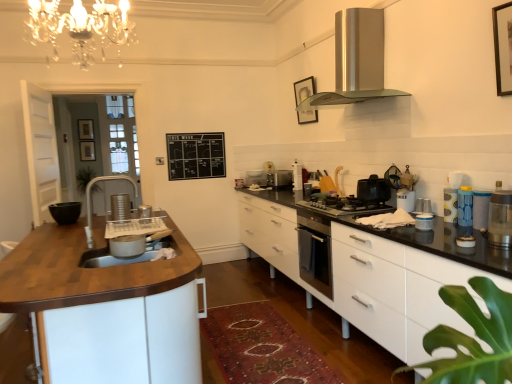
What is the approximate width of wooden picture frame at upper center, positioned as the 2th picture frame in right-to-left order?

The width of wooden picture frame at upper center, positioned as the 2th picture frame in right-to-left order, is 2.83 inches.

How much space does translucent plastic container at right, marked as the 1th kitchen appliance in a front-to-back arrangement, occupy vertically?

It is 9.76 inches.

Measure the distance between satin silver toaster at center, arranged as the second appliance when viewed from the back, and camera.

The distance of satin silver toaster at center, arranged as the second appliance when viewed from the back, from camera is 4.41 meters.

The height and width of the screenshot is (384, 512). What are the coordinates of `black glass gas stove at center` in the screenshot? It's located at (343, 205).

Describe the element at coordinates (424, 221) in the screenshot. I see `blue plastic container at right, which appears as the 7th appliance when viewed from the right` at that location.

Image resolution: width=512 pixels, height=384 pixels. Describe the element at coordinates (406, 199) in the screenshot. I see `white glossy container at right, arranged as the 4th appliance when viewed from the back` at that location.

Locate an element on the screen. The height and width of the screenshot is (384, 512). wooden picture frame at upper center, which is the 3th picture frame from left to right is located at coordinates (304, 89).

From the image's perspective, would you say blue translucent water bottle at right, marked as the 9th appliance in a back-to-front arrangement, is shown under wooden at left?

No, from the image's perspective, blue translucent water bottle at right, marked as the 9th appliance in a back-to-front arrangement, is not beneath wooden at left.

Considering the relative sizes of blue translucent water bottle at right, marked as the 9th appliance in a back-to-front arrangement, and wooden at left in the image provided, is blue translucent water bottle at right, marked as the 9th appliance in a back-to-front arrangement, thinner than wooden at left?

Yes, blue translucent water bottle at right, marked as the 9th appliance in a back-to-front arrangement, is thinner than wooden at left.

Considering the sizes of objects blue translucent water bottle at right, the second appliance positioned from the right, and wooden at left in the image provided, who is taller, blue translucent water bottle at right, the second appliance positioned from the right, or wooden at left?

wooden at left.

From a real-world perspective, is blue translucent water bottle at right, which appears as the third appliance when viewed from the front, on wooden at left?

Yes, from a real-world perspective, blue translucent water bottle at right, which appears as the third appliance when viewed from the front, is above wooden at left.

Who is bigger, blue translucent water bottle at right, the 10th appliance positioned from the left, or black glass stove at center, which ranks as the fourth appliance in left-to-right order?

With larger size is black glass stove at center, which ranks as the fourth appliance in left-to-right order.

Can you confirm if blue translucent water bottle at right, marked as the 9th appliance in a back-to-front arrangement, is thinner than black glass stove at center, arranged as the 3th appliance when viewed from the back?

No.

Considering the sizes of objects blue translucent water bottle at right, marked as the 9th appliance in a back-to-front arrangement, and black glass stove at center, which ranks as the ninth appliance in front-to-back order, in the image provided, who is taller, blue translucent water bottle at right, marked as the 9th appliance in a back-to-front arrangement, or black glass stove at center, which ranks as the ninth appliance in front-to-back order,?

With more height is blue translucent water bottle at right, marked as the 9th appliance in a back-to-front arrangement.

Is the surface of blue translucent water bottle at right, which appears as the third appliance when viewed from the front, in direct contact with black glass stove at center, placed as the 8th appliance when sorted from right to left?

blue translucent water bottle at right, which appears as the third appliance when viewed from the front, and black glass stove at center, placed as the 8th appliance when sorted from right to left, are clearly separated.

Can you see black glass stove at center, arranged as the 3th appliance when viewed from the back, touching white glossy container at right, which appears as the seventh appliance when viewed from the left?

No, black glass stove at center, arranged as the 3th appliance when viewed from the back, is not touching white glossy container at right, which appears as the seventh appliance when viewed from the left.

Considering the positions of objects black glass stove at center, which ranks as the ninth appliance in front-to-back order, and white glossy container at right, the 8th appliance when ordered from front to back, in the image provided, who is more to the right, black glass stove at center, which ranks as the ninth appliance in front-to-back order, or white glossy container at right, the 8th appliance when ordered from front to back,?

white glossy container at right, the 8th appliance when ordered from front to back, is more to the right.

Based on the photo, is black glass stove at center, placed as the 8th appliance when sorted from right to left, bigger or smaller than white glossy container at right, which is the fifth appliance from right to left?

black glass stove at center, placed as the 8th appliance when sorted from right to left, is bigger than white glossy container at right, which is the fifth appliance from right to left.

Looking at this image, from a real-world perspective, which is physically above, black glass stove at center, which ranks as the fourth appliance in left-to-right order, or white glossy container at right, arranged as the 4th appliance when viewed from the back?

black glass stove at center, which ranks as the fourth appliance in left-to-right order.

Does point (292, 168) appear closer or farther from the camera than point (95, 159)?

Clearly, point (292, 168) is closer to the camera than point (95, 159).

From a real-world perspective, between satin silver toaster at center, the third appliance viewed from the left, and wooden picture frame at upper left, the second picture frame from the left, who is vertically higher?

wooden picture frame at upper left, the second picture frame from the left, is physically above.

From the image's perspective, between satin silver toaster at center, which appears as the tenth appliance when viewed from the front, and wooden picture frame at upper left, which is the 1th picture frame from back to front, which one is located above?

From the image's view, wooden picture frame at upper left, which is the 1th picture frame from back to front, is above.

Considering the sizes of objects satin silver toaster at center, arranged as the second appliance when viewed from the back, and wooden picture frame at upper left, which is the 3th picture frame from right to left, in the image provided, who is shorter, satin silver toaster at center, arranged as the second appliance when viewed from the back, or wooden picture frame at upper left, which is the 3th picture frame from right to left,?

With less height is satin silver toaster at center, arranged as the second appliance when viewed from the back.

Find the location of a particular element. The width and height of the screenshot is (512, 384). the 2nd picture frame to the left of the white glossy container at right, arranged as the 4th appliance when viewed from the back, counting from the anchor's position is located at coordinates (87, 150).

Is wooden picture frame at upper left, which is the 1th picture frame from back to front, inside or outside of white glossy container at right, the 8th appliance when ordered from front to back?

The correct answer is: outside.

Does wooden picture frame at upper left, arranged as the 4th picture frame when viewed from the front, have a lesser height compared to white glossy container at right, the 8th appliance when ordered from front to back?

No.

In the scene shown: From the image's perspective, does wooden picture frame at upper left, arranged as the 4th picture frame when viewed from the front, appear lower than white glossy container at right, the 8th appliance when ordered from front to back?

No, from the image's perspective, wooden picture frame at upper left, arranged as the 4th picture frame when viewed from the front, is not beneath white glossy container at right, the 8th appliance when ordered from front to back.

From a real-world perspective, which is physically above, wooden picture frame at upper left, the third picture frame viewed from the front, or black chalkboard at upper center?

In real-world perspective, wooden picture frame at upper left, the third picture frame viewed from the front, is above.

Can you confirm if wooden picture frame at upper left, which is the 1th picture frame from left to right, is taller than black chalkboard at upper center?

No.

From a real-world perspective, which object stands above the other?

black wooden picture frame at upper right, which appears as the 4th picture frame when viewed from the back.

Between black wooden picture frame at upper right, which is the fourth picture frame in left-to-right order, and black chalkboard at upper center, which one appears on the right side from the viewer's perspective?

black wooden picture frame at upper right, which is the fourth picture frame in left-to-right order, is more to the right.

Consider the image. Who is taller, black wooden picture frame at upper right, which appears as the 4th picture frame when viewed from the back, or black chalkboard at upper center?

With more height is black chalkboard at upper center.

Is black wooden picture frame at upper right, which is the fourth picture frame in left-to-right order, closer to camera compared to black chalkboard at upper center?

Yes, black wooden picture frame at upper right, which is the fourth picture frame in left-to-right order, is closer to the camera.

Identify the location of appliance that is the 3rd one when counting backward from the wooden at left. The image size is (512, 384). (465, 206).

Find the location of a particular element. appliance that is the 6th one when counting leftward from the blue translucent water bottle at right, the 10th appliance positioned from the left is located at coordinates (327, 184).

Which object lies further to the anchor point black glass gas stove at center, blue rubber cup at right, the fourth appliance positioned from the front, or white glossy container at right, which is the fifth appliance from right to left?

blue rubber cup at right, the fourth appliance positioned from the front, is positioned further to the anchor black glass gas stove at center.

Based on their spatial positions, is brushed metal faucet at left or wooden picture frame at upper left, the third picture frame viewed from the front, further from white matte cabinet at center?

wooden picture frame at upper left, the third picture frame viewed from the front.

Considering their positions, is blue rubber cup at right, which is the ninth appliance in left-to-right order, positioned further to satin silver toaster at center, placed as the 9th appliance when sorted from right to left, than translucent plastic container at right, acting as the 11th appliance starting from the back?

translucent plastic container at right, acting as the 11th appliance starting from the back.

Consider the image. Based on their spatial positions, is wooden picture frame at upper center, which appears as the third picture frame when viewed from the back, or blue plastic container at right, the second appliance positioned from the front, further from wooden picture frame at upper left, the fourth picture frame from the right?

Based on the image, blue plastic container at right, the second appliance positioned from the front, appears to be further to wooden picture frame at upper left, the fourth picture frame from the right.

Estimate the real-world distances between objects in this image. Which object is closer to blue plastic container at right, the second appliance positioned from the front, black wooden picture frame at upper right, placed as the first picture frame when sorted from right to left, or black chalkboard at upper center?

The object closer to blue plastic container at right, the second appliance positioned from the front, is black wooden picture frame at upper right, placed as the first picture frame when sorted from right to left.

Estimate the real-world distances between objects in this image. Which object is further from wooden picture frame at upper left, arranged as the 2th picture frame when viewed from the back, blue rubber cup at right, which is the ninth appliance in left-to-right order, or translucent plastic container at right, which is the first appliance in right-to-left order?

translucent plastic container at right, which is the first appliance in right-to-left order, is further to wooden picture frame at upper left, arranged as the 2th picture frame when viewed from the back.

Considering their positions, is metallic silver toaster at upper right, acting as the 6th appliance starting from the back, positioned further to wooden picture frame at upper left, which is the 3th picture frame from right to left, than white matte cabinet at center?

white matte cabinet at center is further to wooden picture frame at upper left, which is the 3th picture frame from right to left.

From the image, which object appears to be farther from satin silver range hood at upper center, blue plastic container at right, the second appliance positioned from the front, or wooden at left?

Based on the image, wooden at left appears to be further to satin silver range hood at upper center.

This screenshot has width=512, height=384. I want to click on picture frame positioned between blue translucent water bottle at right, which appears as the third appliance when viewed from the front, and satin silver toaster at center, arranged as the 2th appliance when viewed from the left, from near to far, so click(x=304, y=89).

Locate an element on the screen. The height and width of the screenshot is (384, 512). kitchen appliance positioned between translucent plastic container at right, which is the 2th kitchen appliance in back-to-front order, and satin silver toaster at center, which appears as the tenth appliance when viewed from the front, from near to far is located at coordinates (373, 189).

This screenshot has width=512, height=384. Identify the location of home appliance between metallic silver toaster at upper right, which is counted as the sixth appliance, starting from the front, and black chalkboard at upper center in the front-back direction. (356, 60).

This screenshot has width=512, height=384. I want to click on home appliance between brushed metal faucet at left and satin silver toaster at center, arranged as the 2th appliance when viewed from the left, along the z-axis, so click(356, 60).